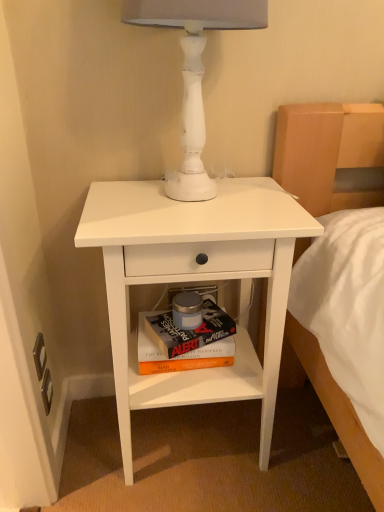
Question: Is hardcover book at center at the right side of white matte nightstand at center?

Choices:
 (A) yes
 (B) no

Answer: (B)

Question: Does hardcover book at center have a lesser height compared to white matte nightstand at center?

Choices:
 (A) yes
 (B) no

Answer: (A)

Question: From a real-world perspective, is hardcover book at center on top of white matte nightstand at center?

Choices:
 (A) yes
 (B) no

Answer: (B)

Question: From a real-world perspective, is hardcover book at center below white matte nightstand at center?

Choices:
 (A) yes
 (B) no

Answer: (A)

Question: Can you confirm if hardcover book at center is thinner than white matte nightstand at center?

Choices:
 (A) yes
 (B) no

Answer: (A)

Question: Is hardcover book at center positioned before white matte nightstand at center?

Choices:
 (A) no
 (B) yes

Answer: (A)

Question: From a real-world perspective, is hardcover book at center below white matte table lamp at upper center?

Choices:
 (A) yes
 (B) no

Answer: (A)

Question: Is hardcover book at center smaller than white matte table lamp at upper center?

Choices:
 (A) yes
 (B) no

Answer: (A)

Question: Can you confirm if hardcover book at center is positioned to the right of white matte table lamp at upper center?

Choices:
 (A) no
 (B) yes

Answer: (A)

Question: Is hardcover book at center not within white matte table lamp at upper center?

Choices:
 (A) yes
 (B) no

Answer: (A)

Question: Is hardcover book at center positioned in front of white matte table lamp at upper center?

Choices:
 (A) yes
 (B) no

Answer: (B)

Question: Considering the relative sizes of hardcover book at center and white matte table lamp at upper center in the image provided, is hardcover book at center bigger than white matte table lamp at upper center?

Choices:
 (A) no
 (B) yes

Answer: (A)

Question: From the image's perspective, does white matte nightstand at center appear lower than white matte table lamp at upper center?

Choices:
 (A) yes
 (B) no

Answer: (A)